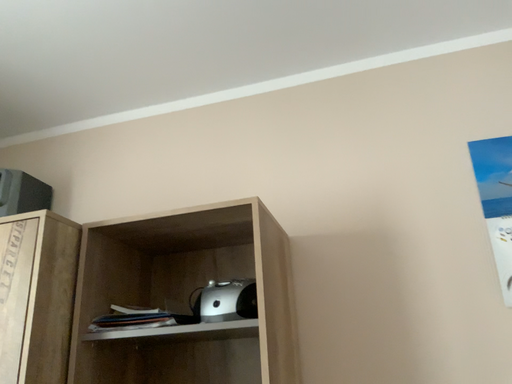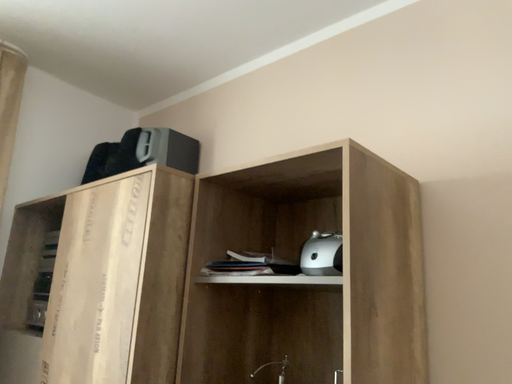
Question: Which way did the camera rotate in the video?

Choices:
 (A) rotated right
 (B) rotated left

Answer: (B)